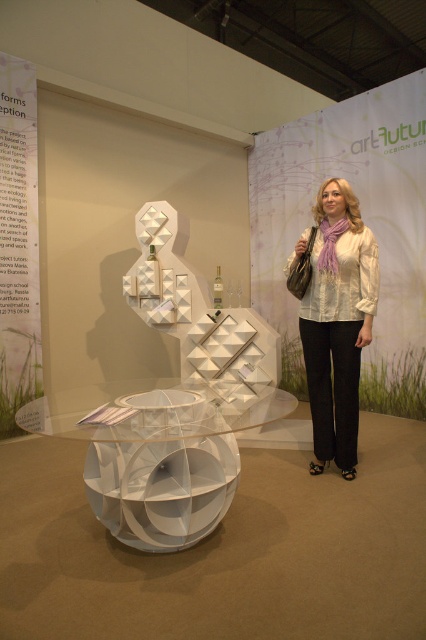
Measure the distance from white matte sculpture at center to white sheer blouse at center.

white matte sculpture at center and white sheer blouse at center are 32.91 inches apart from each other.

Is white matte sculpture at center shorter than white sheer blouse at center?

Correct, white matte sculpture at center is not as tall as white sheer blouse at center.

Which is behind, point (210, 320) or point (314, 246)?

Positioned behind is point (210, 320).

Locate an element on the screen. The width and height of the screenshot is (426, 640). white matte sculpture at center is located at coordinates (181, 401).